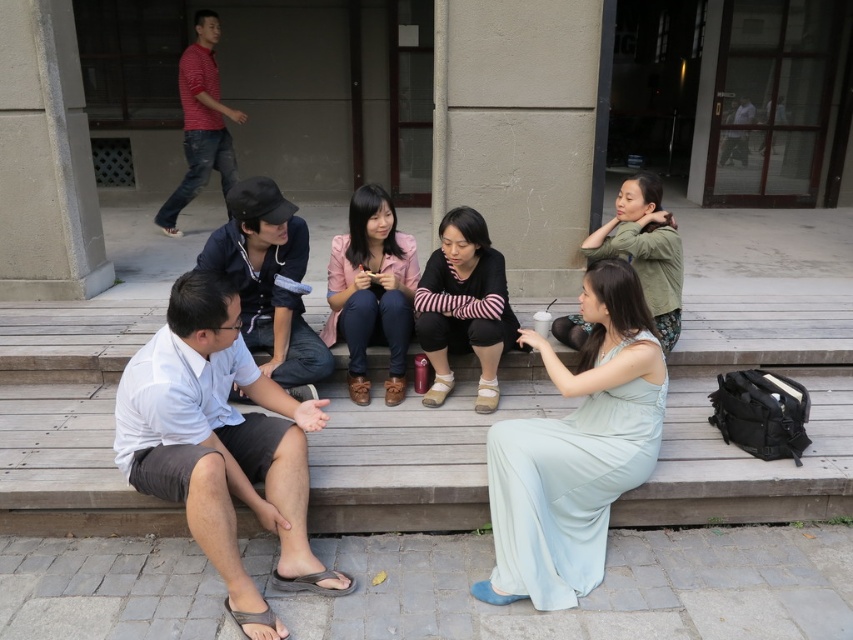
You are a photographer trying to capture a candid shot of the group. The light blue silk dress at lower right and the pink matte jacket at center are key subjects. Given that your camera has a maximum focus range of 40 inches, can you ensure both subjects are in focus without moving the camera?

The light blue silk dress at lower right is 38.95 inches away from the pink matte jacket at center. Since the distance between them is within the camera maximum focus range of 40 inches, both subjects can be in focus without moving the camera.

You are standing at the entrance of the building and want to take a photo of the black striped sweater at center. Where should you position yourself to capture it in the frame?

The black striped sweater at center is located at the center of the image, so positioning yourself directly in front of the building entrance facing the group will allow you to capture it in the frame.

You are a photographer standing 10 feet away from the group. You want to take a closeup shot of the black striped sweater at center without including the light blue silk dress at lower right in the frame. Is this possible given their current positions?

The distance between the light blue silk dress at lower right and the black striped sweater at center is 25.45 inches. Since you are 10 feet away, adjusting your camera angle slightly could allow you to focus on the black striped sweater at center while excluding the light blue silk dress at lower right, as they are separated by a measurable distance.